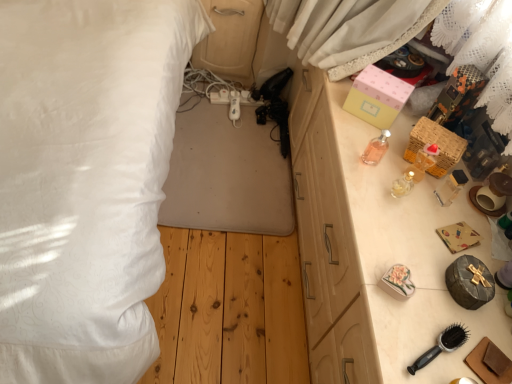
Identify the location of vacant space to the left of pink paper box at upper right, which is the second box from bottom to top. This screenshot has height=384, width=512. pos(329,95).